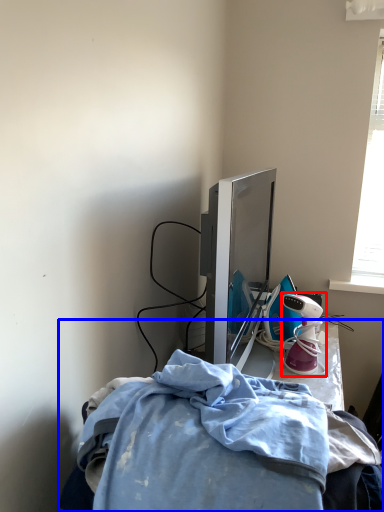
Question: Which of the following is the closest to the observer, toy (highlighted by a red box) or furniture (highlighted by a blue box)?

Choices:
 (A) toy
 (B) furniture

Answer: (B)